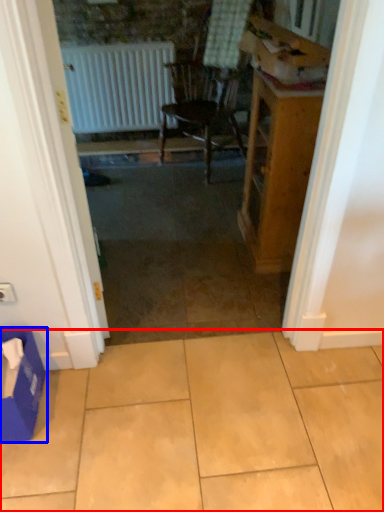
Question: Which of the following is the farthest to the observer, ceramic tile (highlighted by a red box) or cardboard box (highlighted by a blue box)?

Choices:
 (A) ceramic tile
 (B) cardboard box

Answer: (B)